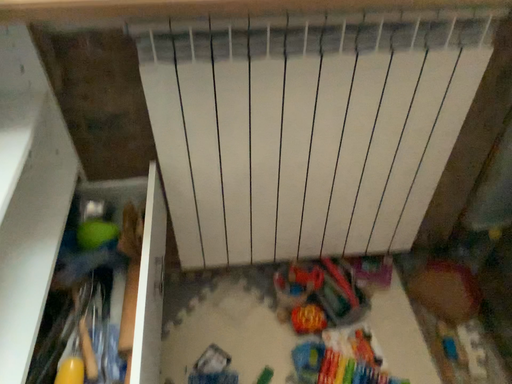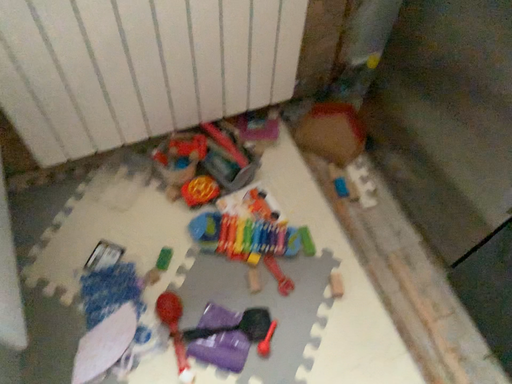
Question: How did the camera likely rotate when shooting the video?

Choices:
 (A) rotated downward
 (B) rotated upward

Answer: (A)